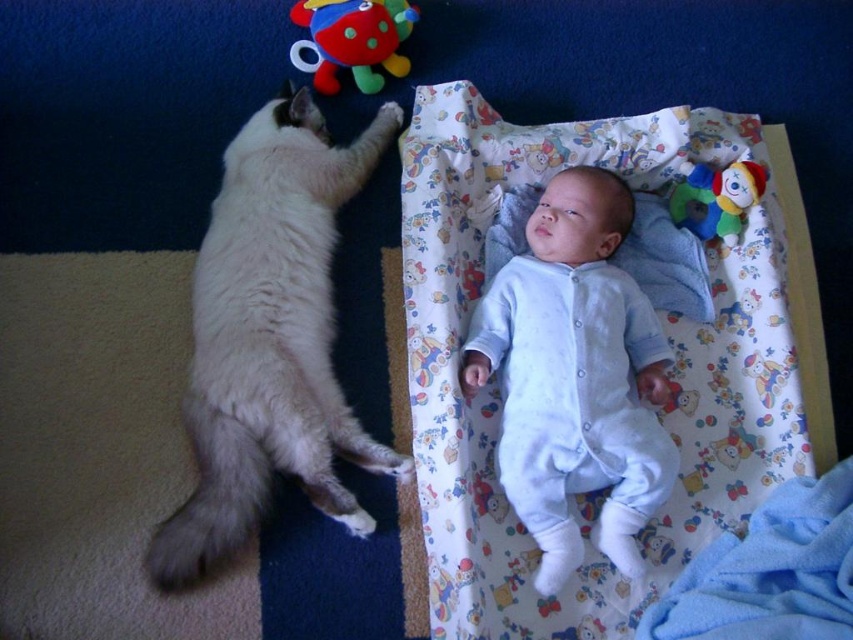
Question: Does light blue cotton onesie at center appear on the right side of blue soft blanket at lower right?

Choices:
 (A) yes
 (B) no

Answer: (B)

Question: Is light blue cotton onesie at center thinner than multicolored plush clown at upper right?

Choices:
 (A) no
 (B) yes

Answer: (A)

Question: Which of these objects is positioned farthest from the white fur cat at left?

Choices:
 (A) light blue cotton onesie at center
 (B) multicolored plush clown at upper right

Answer: (B)

Question: Does fluffy white blanket at upper right have a greater width compared to light blue cotton onesie at center?

Choices:
 (A) no
 (B) yes

Answer: (B)

Question: Which object appears farthest from the camera in this image?

Choices:
 (A) blue soft blanket at lower right
 (B) multicolored plush clown at upper right
 (C) white fur cat at left
 (D) fluffy white blanket at upper right

Answer: (B)

Question: Which point is closer to the camera taking this photo?

Choices:
 (A) (155, 570)
 (B) (668, 445)
 (C) (717, 461)
 (D) (326, 90)

Answer: (A)